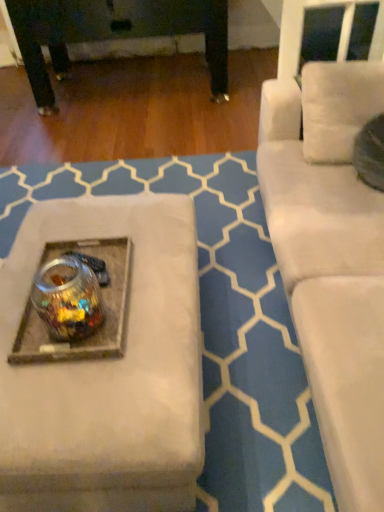
Question: Can you confirm if transparent glass jar at center is taller than clear glass jar at center?

Choices:
 (A) yes
 (B) no

Answer: (A)

Question: Are transparent glass jar at center and clear glass jar at center making contact?

Choices:
 (A) yes
 (B) no

Answer: (A)

Question: Can you confirm if transparent glass jar at center is thinner than clear glass jar at center?

Choices:
 (A) yes
 (B) no

Answer: (A)

Question: Does transparent glass jar at center have a larger size compared to clear glass jar at center?

Choices:
 (A) yes
 (B) no

Answer: (A)

Question: Is transparent glass jar at center located outside clear glass jar at center?

Choices:
 (A) yes
 (B) no

Answer: (A)

Question: Is transparent glass jar at center aimed at clear glass jar at center?

Choices:
 (A) no
 (B) yes

Answer: (A)

Question: From a real-world perspective, is clear glass jar at center below transparent glass jar at center?

Choices:
 (A) no
 (B) yes

Answer: (B)

Question: Is clear glass jar at center at the right side of transparent glass jar at center?

Choices:
 (A) no
 (B) yes

Answer: (A)

Question: Is clear glass jar at center facing away from transparent glass jar at center?

Choices:
 (A) yes
 (B) no

Answer: (B)

Question: From a real-world perspective, is clear glass jar at center over transparent glass jar at center?

Choices:
 (A) yes
 (B) no

Answer: (B)

Question: Does clear glass jar at center have a larger size compared to transparent glass jar at center?

Choices:
 (A) yes
 (B) no

Answer: (B)

Question: From the image's perspective, is clear glass jar at center on top of transparent glass jar at center?

Choices:
 (A) yes
 (B) no

Answer: (A)

Question: Does point (56, 340) appear closer or farther from the camera than point (74, 316)?

Choices:
 (A) closer
 (B) farther

Answer: (B)